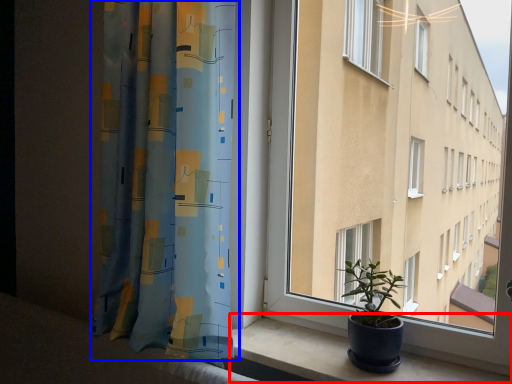
Question: Which of the following is the farthest to the observer, window sill (highlighted by a red box) or curtain (highlighted by a blue box)?

Choices:
 (A) window sill
 (B) curtain

Answer: (B)